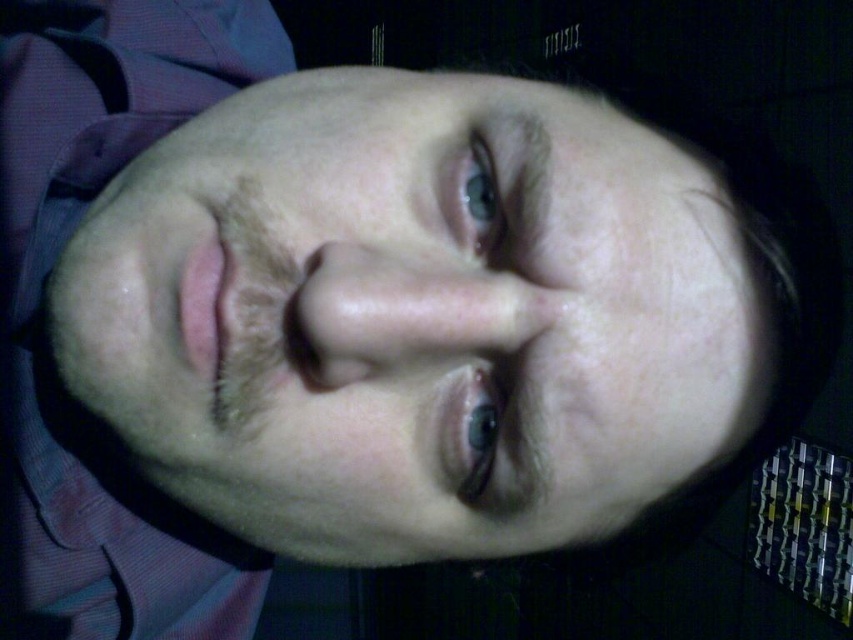
You are a photographer using a camera with a focal length of 50mm. You want to capture a close portrait of a person with a point at coordinates point (154, 170). If the distance from the camera to this point must be exactly 16 inches for optimal focus, should you move closer or farther away from the subject?

The distance of point (154, 170) from camera is 15.45 inches. Since the required distance is 16 inches, you should move slightly farther away from the subject to increase the distance to 16 inches.

You are a photographer reviewing a portrait taken at night. You notice the smooth skin face at center and the blue glossy eye at upper center. Based on their positions, which object is located more to the left in the image?

The smooth skin face at center is located more to the left than the blue glossy eye at upper center.

You are a photographer adjusting the focus of your camera. You notice the smooth skin face at center and the blue glossy eye at upper center. Which object should you focus on to ensure the subject is sharp and in focus?

You should focus on the blue glossy eye at upper center because the smooth skin face at center is in front of it, meaning the eye is closer to the camera and would require precise focusing for sharpness.